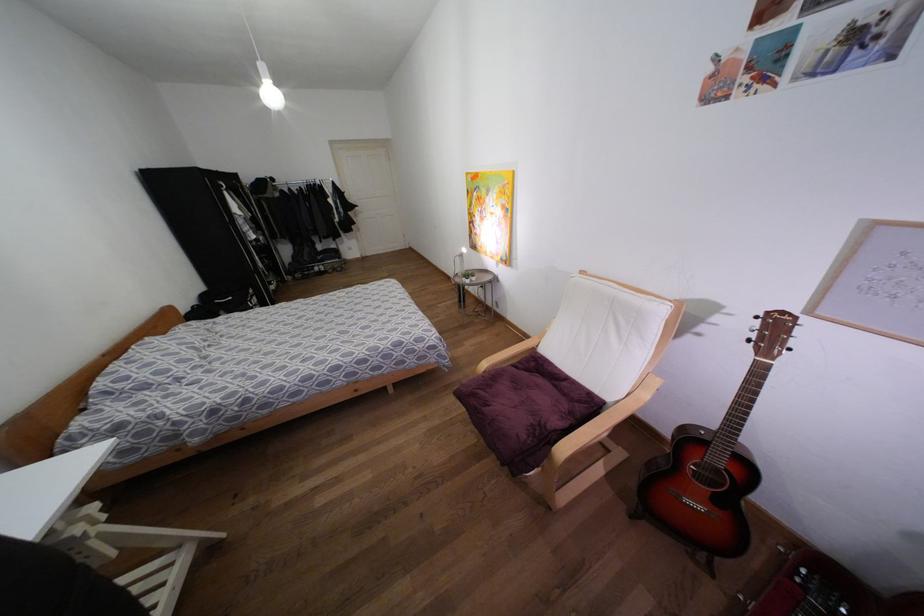
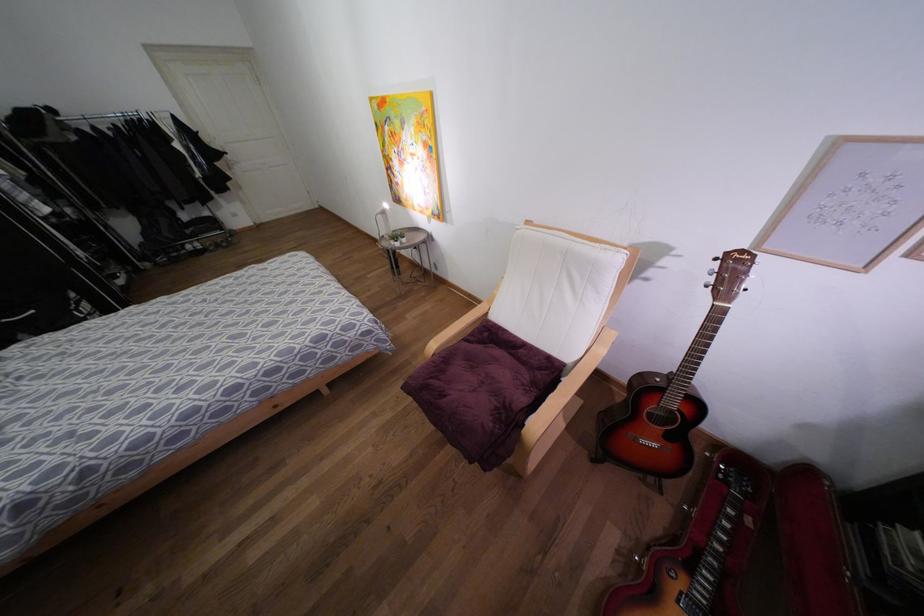
Question: The images are taken continuously from a first-person perspective. In which direction are you moving?

Choices:
 (A) Left
 (B) Right
 (C) Forward
 (D) Backward

Answer: (C)